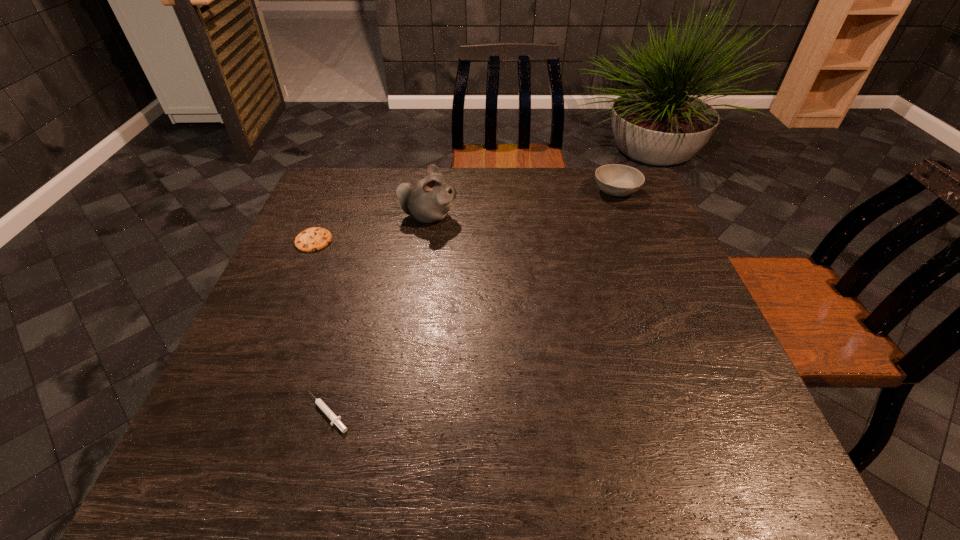
Locate an element on the screen. Image resolution: width=960 pixels, height=540 pixels. empty space that is in between the cookie and the second farthest object is located at coordinates (372, 228).

I want to click on vacant point located between the second object from right to left and the second object from left to right, so click(378, 315).

Identify the location of object that is the closest one to the third farthest object. (428, 200).

Where is `object that can be found as the closest to the leftmost object`? The width and height of the screenshot is (960, 540). object that can be found as the closest to the leftmost object is located at coordinates (428, 200).

This screenshot has height=540, width=960. Identify the location of free space that satisfies the following two spatial constraints: 1. on the face of the second farthest object; 2. on the front side of the second object from left to right. pos(401,413).

At what (x,y) coordinates should I click in order to perform the action: click on vacant space that satisfies the following two spatial constraints: 1. on the front side of the second tallest object; 2. on the face of the second farthest object. Please return your answer as a coordinate pair (x, y). The width and height of the screenshot is (960, 540). Looking at the image, I should click on (626, 217).

Locate an element on the screen. free region that satisfies the following two spatial constraints: 1. on the back side of the cookie; 2. on the left side of the farthest object is located at coordinates (335, 191).

Identify the location of vacant space that satisfies the following two spatial constraints: 1. on the face of the second farthest object; 2. on the front side of the syringe. Image resolution: width=960 pixels, height=540 pixels. (401, 413).